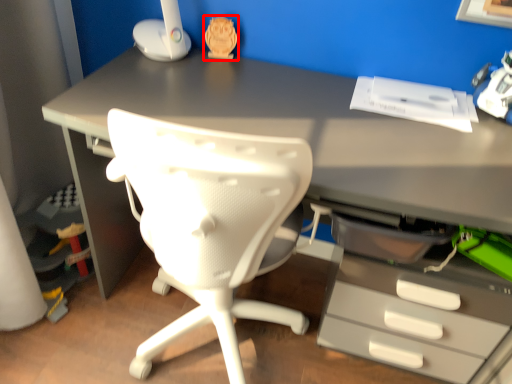
Question: In this image, where is toy (annotated by the red box) located relative to toy?

Choices:
 (A) right
 (B) left

Answer: (B)